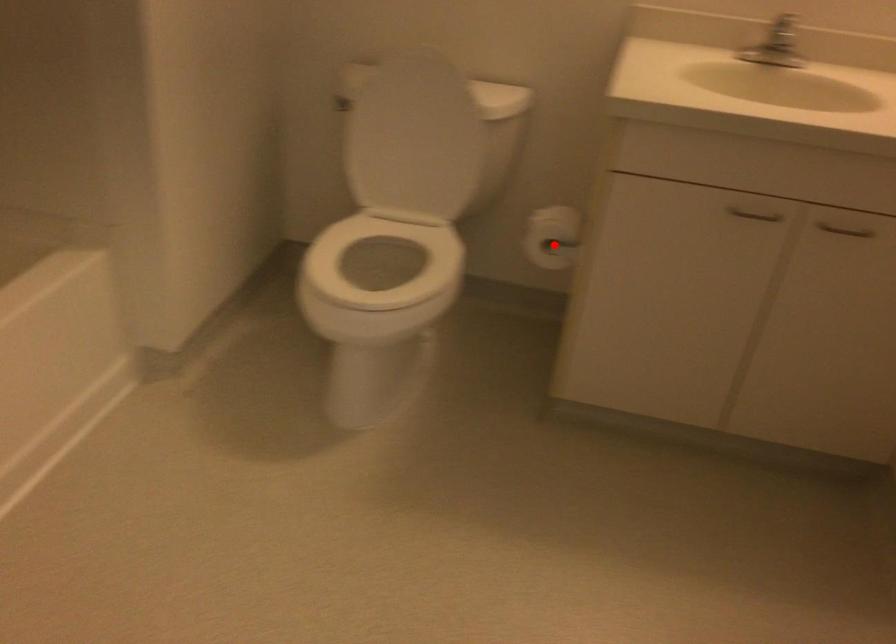
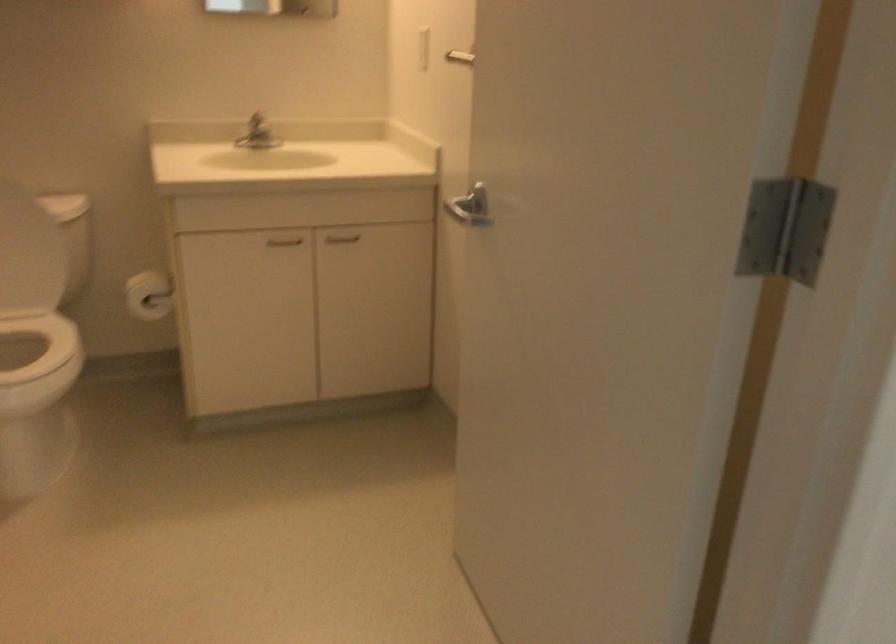
Locate, in the second image, the point that corresponds to the highlighted location in the first image.

(149, 295)